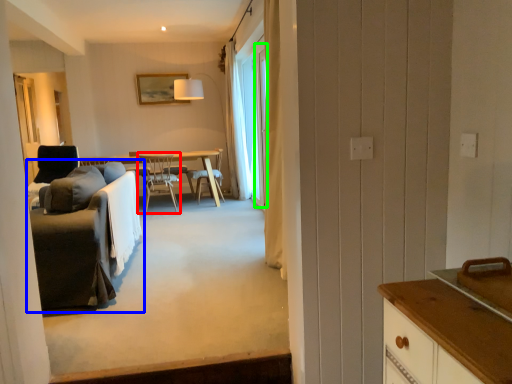
Question: Considering the real-world distances, which object is closest to chair (highlighted by a red box)? studio couch (highlighted by a blue box) or window (highlighted by a green box).

Choices:
 (A) studio couch
 (B) window

Answer: (B)